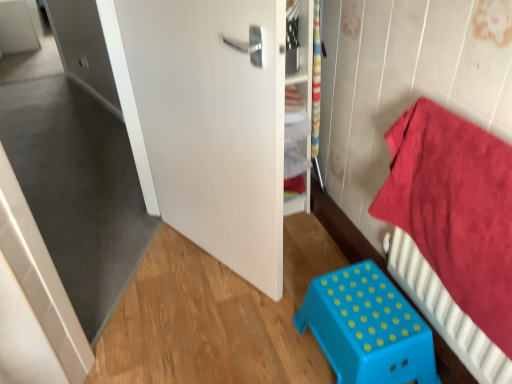
Question: Considering the relative positions of white matte door at center and red cotton towel at right in the image provided, is white matte door at center to the right of red cotton towel at right from the viewer's perspective?

Choices:
 (A) no
 (B) yes

Answer: (A)

Question: Is white matte door at center wider than red cotton towel at right?

Choices:
 (A) no
 (B) yes

Answer: (B)

Question: Does white matte door at center have a smaller size compared to red cotton towel at right?

Choices:
 (A) yes
 (B) no

Answer: (B)

Question: Is white matte door at center next to red cotton towel at right and touching it?

Choices:
 (A) yes
 (B) no

Answer: (B)

Question: Is red cotton towel at right located within white matte door at center?

Choices:
 (A) no
 (B) yes

Answer: (A)

Question: Is white matte door at center closer to camera compared to red cotton towel at right?

Choices:
 (A) yes
 (B) no

Answer: (B)

Question: Is blue plastic stool at lower center taller than white matte door at center?

Choices:
 (A) no
 (B) yes

Answer: (A)

Question: Is blue plastic stool at lower center oriented away from white matte door at center?

Choices:
 (A) no
 (B) yes

Answer: (A)

Question: Does blue plastic stool at lower center lie behind white matte door at center?

Choices:
 (A) yes
 (B) no

Answer: (A)

Question: Is blue plastic stool at lower center not near white matte door at center?

Choices:
 (A) no
 (B) yes

Answer: (A)

Question: Considering the relative sizes of blue plastic stool at lower center and white matte door at center in the image provided, is blue plastic stool at lower center shorter than white matte door at center?

Choices:
 (A) yes
 (B) no

Answer: (A)

Question: From the image's perspective, is blue plastic stool at lower center over white matte door at center?

Choices:
 (A) no
 (B) yes

Answer: (A)

Question: Is white matte door at center to the left of blue plastic stool at lower center from the viewer's perspective?

Choices:
 (A) no
 (B) yes

Answer: (B)